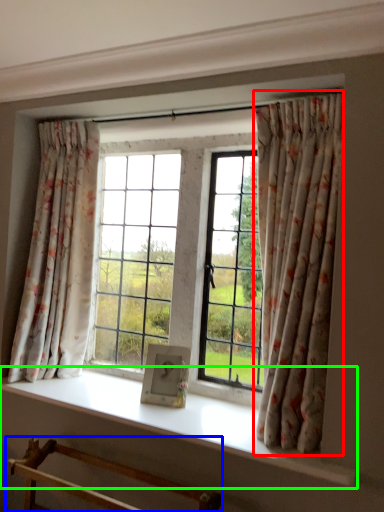
Question: Estimate the real-world distances between objects in this image. Which object is closer to curtain (highlighted by a red box), furniture (highlighted by a blue box) or window sill (highlighted by a green box)?

Choices:
 (A) furniture
 (B) window sill

Answer: (B)